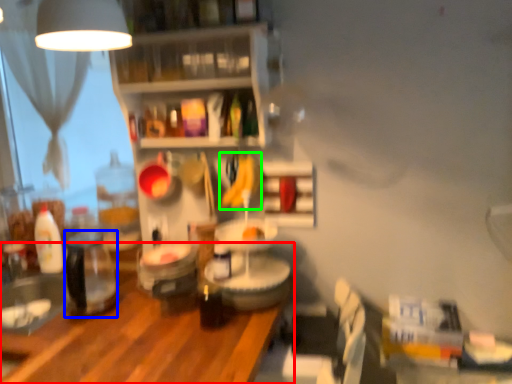
Question: Estimate the real-world distances between objects in this image. Which object is closer to table (highlighted by a red box), appliance (highlighted by a blue box) or banana (highlighted by a green box)?

Choices:
 (A) appliance
 (B) banana

Answer: (A)